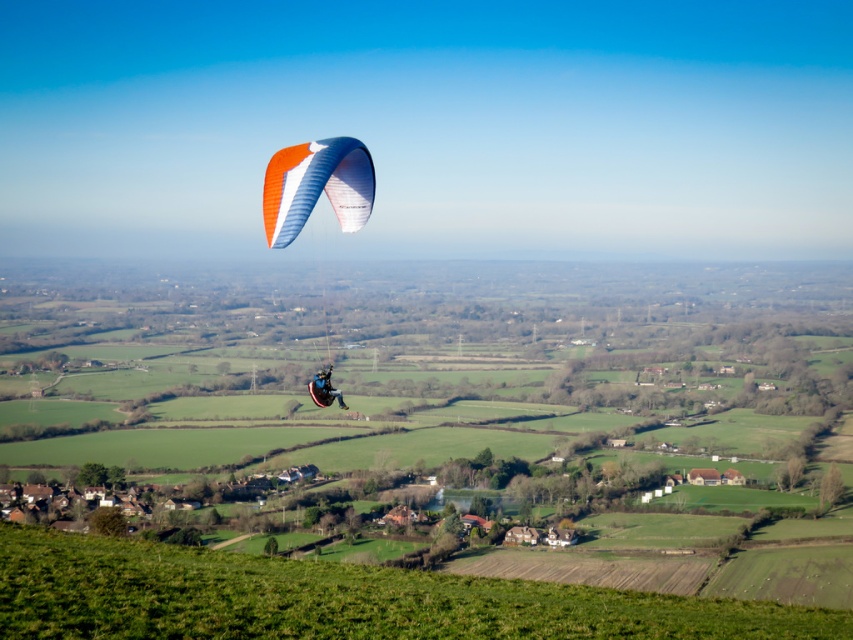
You are standing at the top of the grassy hill and want to take a photo of the two points mentioned in the scene. Which point, point (286, 209) or point (321, 390), will appear larger in your photo?

Point (286, 209) will appear larger in the photo because it is closer to the camera than point (321, 390).